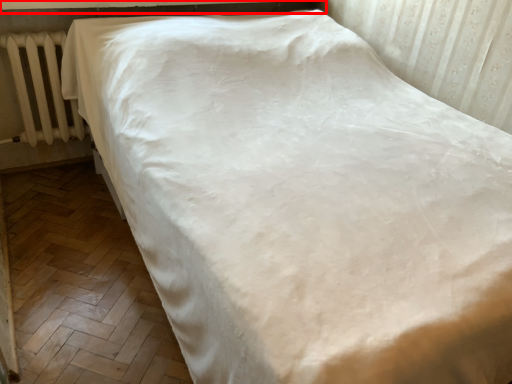
Question: From the image's perspective, where is window sill (annotated by the red box) located in relation to radiator in the image?

Choices:
 (A) above
 (B) below

Answer: (A)